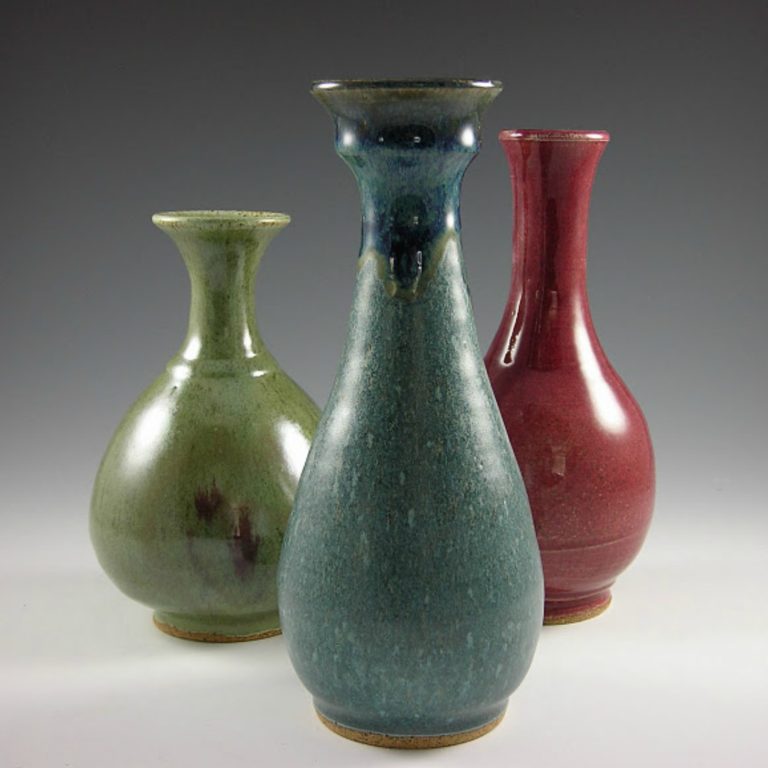
Where is `light`? This screenshot has width=768, height=768. light is located at coordinates (714, 514).